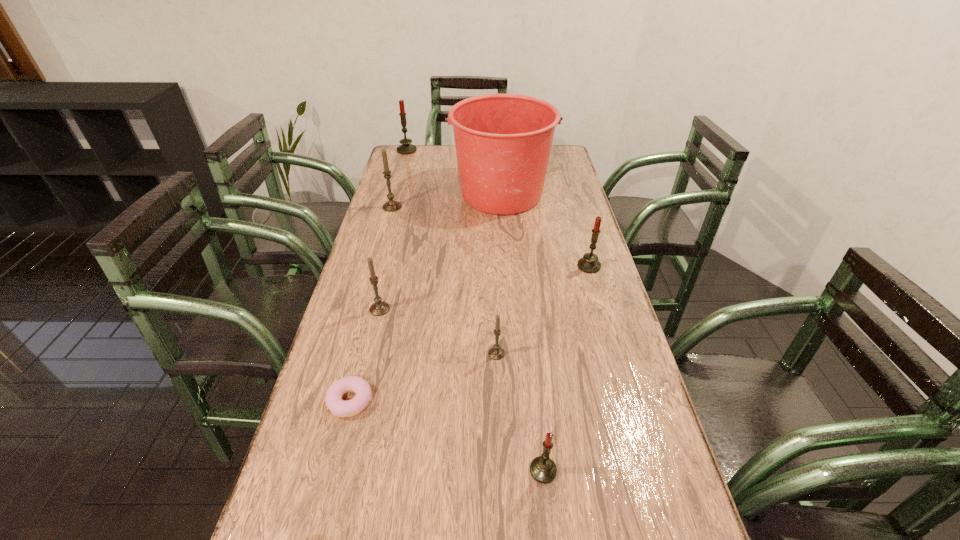
Where is `vacant space in between the biggest gray candle and the third nearest candle`? This screenshot has height=540, width=960. vacant space in between the biggest gray candle and the third nearest candle is located at coordinates (386, 258).

You are a GUI agent. You are given a task and a screenshot of the screen. Output one action in this format:
    pyautogui.click(x=<x>, y=<y>)
    Task: Click on the vacant point located between the smallest red candle and the second smallest red candle
    This screenshot has width=960, height=540.
    Given the screenshot: What is the action you would take?
    pyautogui.click(x=566, y=368)

The width and height of the screenshot is (960, 540). Identify the location of the closest object relative to the farthest candle. (503, 142).

Point out which object is positioned as the nearest to the bucket. Please provide its 2D coordinates. Your answer should be formatted as a tuple, i.e. [(x, y)], where the tuple contains the x and y coordinates of a point satisfying the conditions above.

[(390, 206)]

Locate which candle is the second closest to the bucket. Please provide its 2D coordinates. Your answer should be formatted as a tuple, i.e. [(x, y)], where the tuple contains the x and y coordinates of a point satisfying the conditions above.

[(589, 263)]

Locate which candle ranks third in proximity to the second smallest red candle. Please provide its 2D coordinates. Your answer should be formatted as a tuple, i.e. [(x, y)], where the tuple contains the x and y coordinates of a point satisfying the conditions above.

[(542, 469)]

Where is `red candle that is the closest one to the seventh farthest object`? The width and height of the screenshot is (960, 540). red candle that is the closest one to the seventh farthest object is located at coordinates (542, 469).

Identify which red candle is located as the second nearest to the sixth farthest object. Please provide its 2D coordinates. Your answer should be formatted as a tuple, i.e. [(x, y)], where the tuple contains the x and y coordinates of a point satisfying the conditions above.

[(589, 263)]

Identify which gray candle is located as the second nearest to the biggest gray candle. Please provide its 2D coordinates. Your answer should be formatted as a tuple, i.e. [(x, y)], where the tuple contains the x and y coordinates of a point satisfying the conditions above.

[(496, 353)]

Identify the location of gray candle that can be found as the second closest to the farthest gray candle. This screenshot has height=540, width=960. (496, 353).